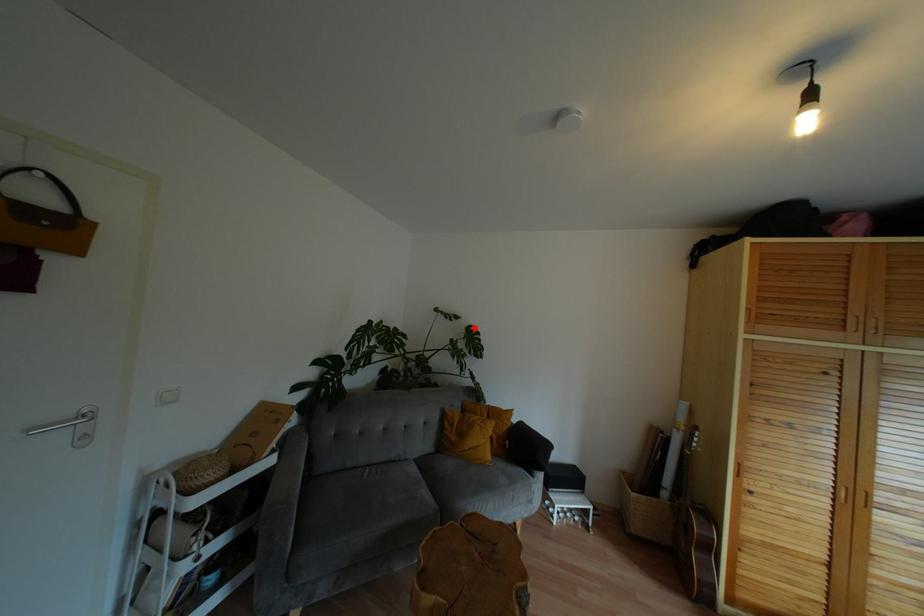
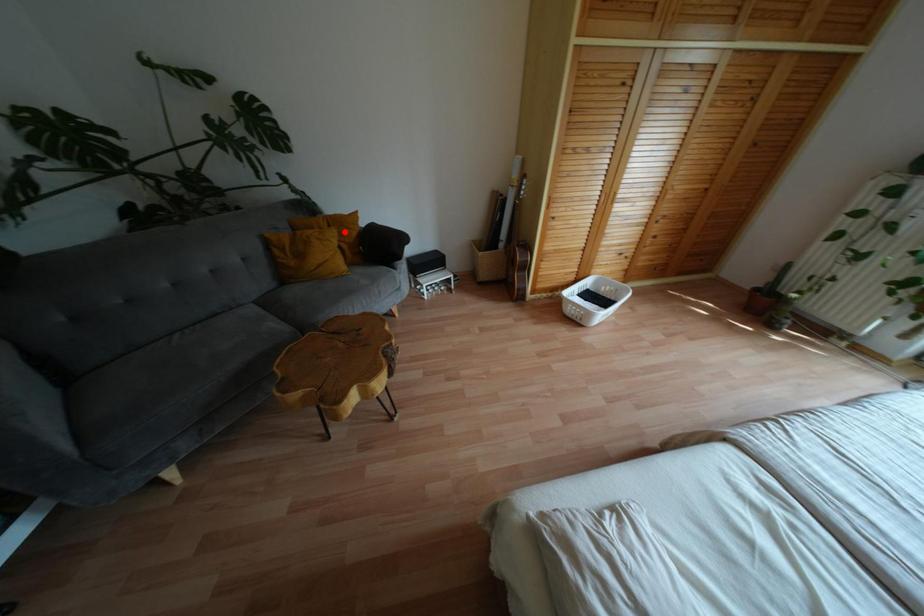
I am providing you with two images of the same scene from different viewpoints. A red point is marked on the first image and another point is marked on the second image. Are the points marked in image1 and image2 representing the same 3D position?

No